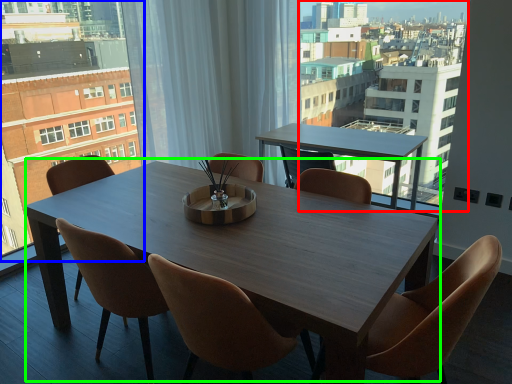
Question: Which object is the closest to the condominium (highlighted by a red box)? Choose among these: condominium (highlighted by a blue box) or kitchen & dining room table (highlighted by a green box).

Choices:
 (A) condominium
 (B) kitchen & dining room table

Answer: (B)